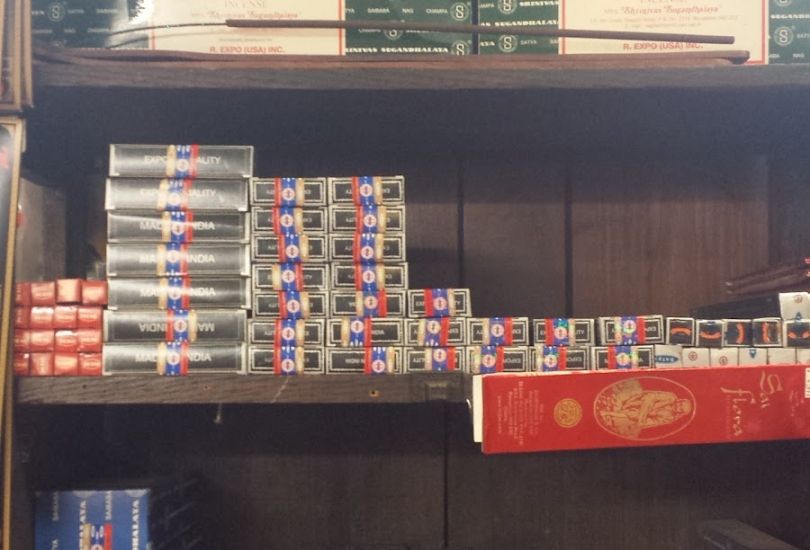
Find the location of a particular element. The image size is (810, 550). shelf is located at coordinates (207, 75), (243, 395).